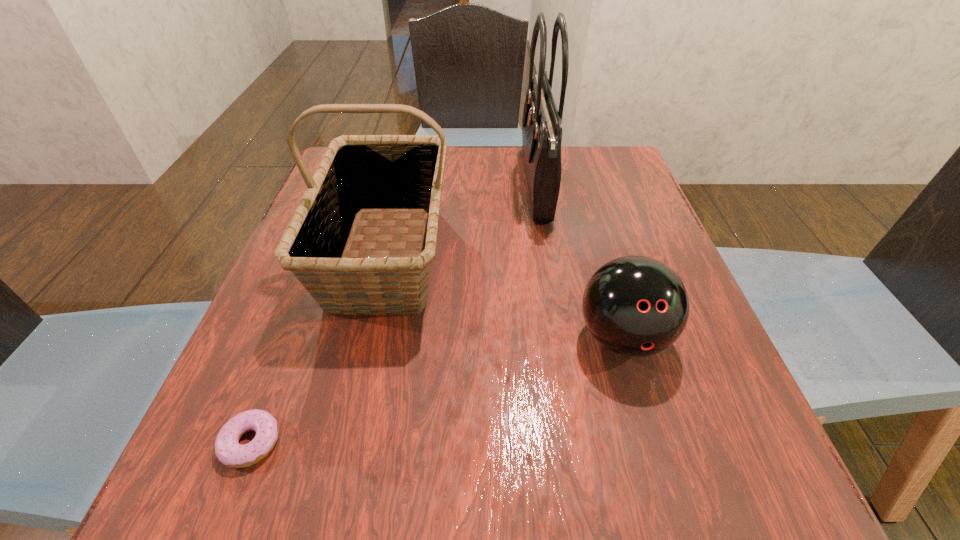
The image size is (960, 540). I want to click on handbag, so click(542, 123).

The width and height of the screenshot is (960, 540). I want to click on the second tallest object, so click(x=358, y=174).

Locate an element on the screen. This screenshot has width=960, height=540. the second shortest object is located at coordinates (636, 306).

Image resolution: width=960 pixels, height=540 pixels. What are the coordinates of `the shortest object` in the screenshot? It's located at (229, 452).

Find the location of a particular element. Image resolution: width=960 pixels, height=540 pixels. the nearest object is located at coordinates 229,452.

Identify the location of vacant space located with an open clasp on the front of the handbag. Image resolution: width=960 pixels, height=540 pixels. (497, 185).

You are a GUI agent. You are given a task and a screenshot of the screen. Output one action in this format:
    pyautogui.click(x=<x>, y=<y>)
    Task: Click on the vacant space situated with an open clasp on the front of the handbag
    The image size is (960, 540).
    Given the screenshot: What is the action you would take?
    pyautogui.click(x=432, y=185)

Where is `blank area located with an open clasp on the front of the handbag`? This screenshot has height=540, width=960. blank area located with an open clasp on the front of the handbag is located at coordinates (490, 185).

Identify the location of vacant space located by the handle of the basket. This screenshot has width=960, height=540. (342, 455).

Locate an element on the screen. The width and height of the screenshot is (960, 540). vacant space located 0.190m on the surface of the bowling ball near the finger holes is located at coordinates (673, 509).